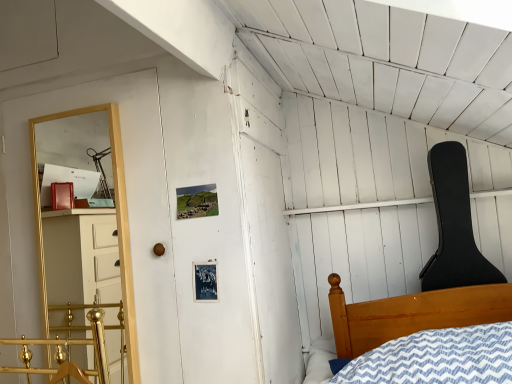
Question: From a real-world perspective, is gold metallic rail at lower left positioned over gold wooden shelf at left based on gravity?

Choices:
 (A) yes
 (B) no

Answer: (B)

Question: Would you say gold metallic rail at lower left is outside gold wooden shelf at left?

Choices:
 (A) no
 (B) yes

Answer: (B)

Question: Is gold wooden shelf at left surrounded by gold metallic rail at lower left?

Choices:
 (A) yes
 (B) no

Answer: (B)

Question: Considering the relative sizes of gold metallic rail at lower left and gold wooden shelf at left in the image provided, is gold metallic rail at lower left wider than gold wooden shelf at left?

Choices:
 (A) no
 (B) yes

Answer: (A)

Question: Can you confirm if gold metallic rail at lower left is taller than gold wooden shelf at left?

Choices:
 (A) no
 (B) yes

Answer: (A)

Question: From the image's perspective, is gold metallic rail at lower left beneath gold wooden shelf at left?

Choices:
 (A) yes
 (B) no

Answer: (A)

Question: Does gold wooden shelf at left have a greater width compared to black hard case guitar at upper right?

Choices:
 (A) no
 (B) yes

Answer: (A)

Question: Are gold wooden shelf at left and black hard case guitar at upper right far apart?

Choices:
 (A) yes
 (B) no

Answer: (A)

Question: Considering the relative positions of gold wooden shelf at left and black hard case guitar at upper right in the image provided, is gold wooden shelf at left to the right of black hard case guitar at upper right from the viewer's perspective?

Choices:
 (A) no
 (B) yes

Answer: (A)

Question: Is gold wooden shelf at left completely or partially outside of black hard case guitar at upper right?

Choices:
 (A) no
 (B) yes

Answer: (B)

Question: Is gold wooden shelf at left aimed at black hard case guitar at upper right?

Choices:
 (A) no
 (B) yes

Answer: (A)

Question: Is black hard case guitar at upper right at the back of gold wooden shelf at left?

Choices:
 (A) yes
 (B) no

Answer: (B)

Question: Is gold metallic rail at lower left touching black hard case guitar at upper right?

Choices:
 (A) no
 (B) yes

Answer: (A)